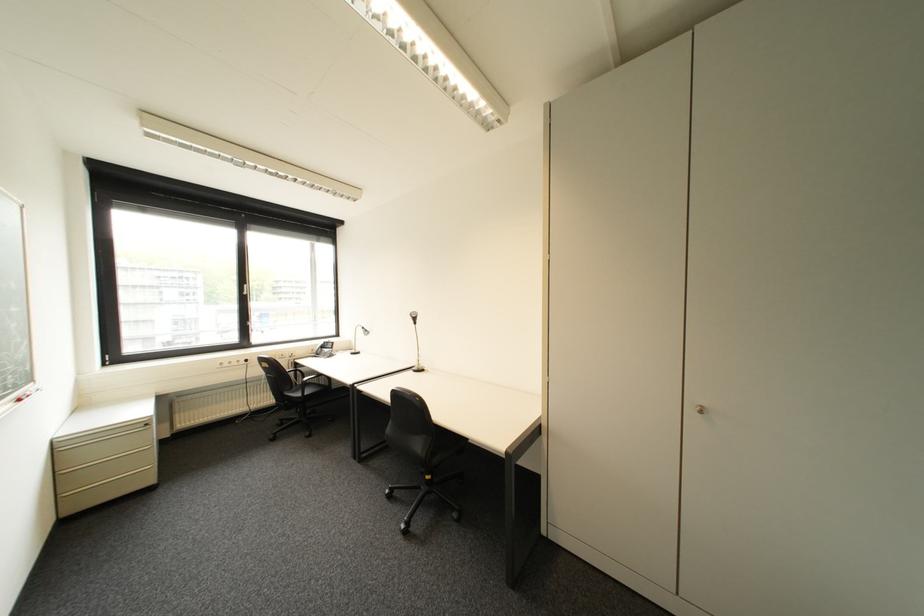
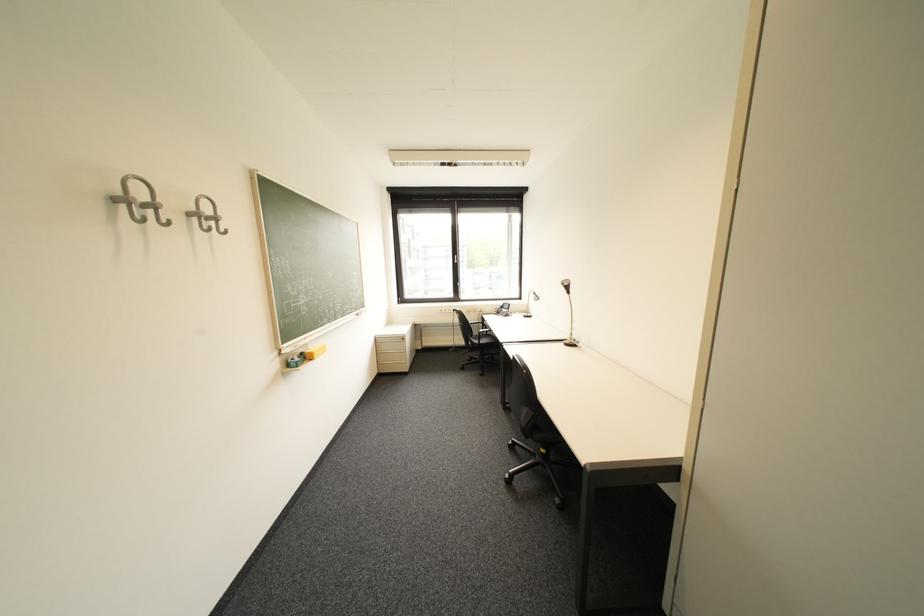
In the second image, find the point that corresponds to pixel 71 450 in the first image.

(388, 342)